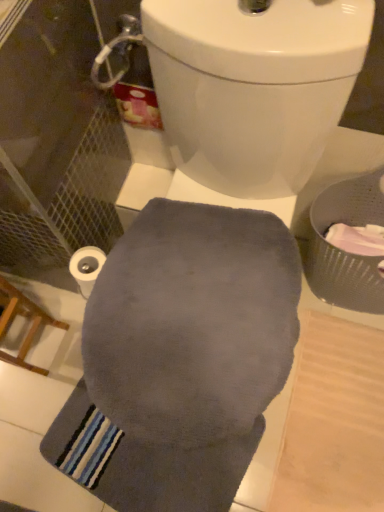
The image size is (384, 512). I want to click on free point above gray soft towel at center (from a real-world perspective), so click(157, 467).